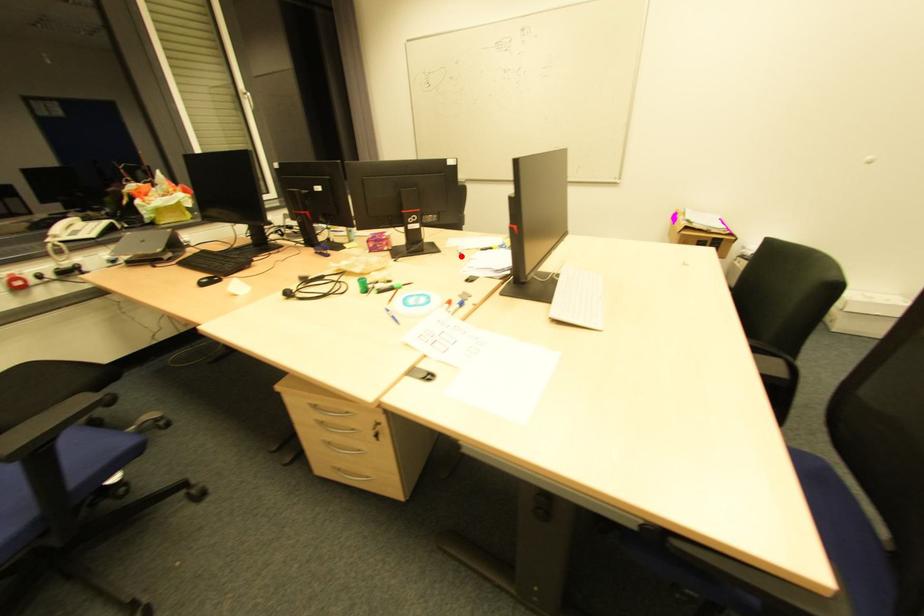
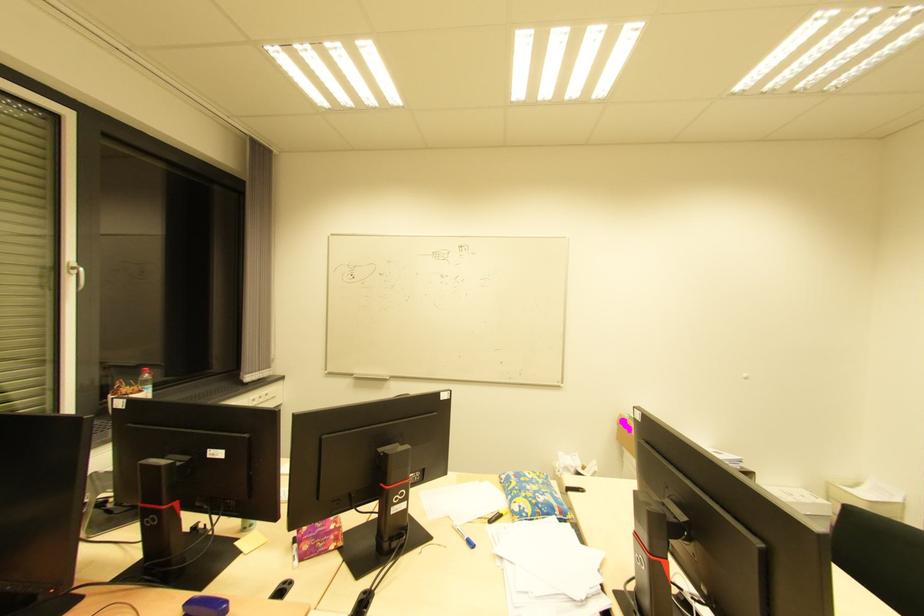
The point at the highlighted location is marked in the first image. Where is the corresponding point in the second image?

(470, 546)